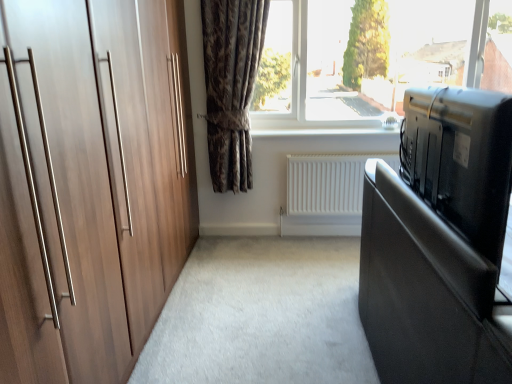
At what (x,y) coordinates should I click in order to perform the action: click on free space below dark brown textured curtain at center (from a real-world perspective). Please return your answer as a coordinate pair (x, y). Image resolution: width=512 pixels, height=384 pixels. Looking at the image, I should click on (244, 242).